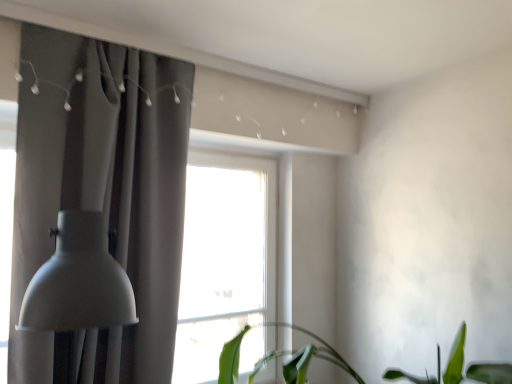
You are a GUI agent. You are given a task and a screenshot of the screen. Output one action in this format:
    pyautogui.click(x=<x>, y=<y>)
    Task: Click on the green leafy plant at lower center
    This screenshot has width=512, height=384.
    Given the screenshot: What is the action you would take?
    pyautogui.click(x=280, y=356)

At what (x,y) coordinates should I click in order to perform the action: click on matte gray curtain at left. Please return your answer as a coordinate pair (x, y). Looking at the image, I should click on (102, 187).

Measure the distance from matte gray curtain at left to green leafy plant at lower center.

The distance of matte gray curtain at left from green leafy plant at lower center is 92.61 centimeters.

From the image's perspective, relative to green leafy plant at lower center, is matte gray curtain at left above or below?

matte gray curtain at left is situated higher than green leafy plant at lower center in the image.

Considering the positions of point (166, 313) and point (275, 352), is point (166, 313) closer or farther from the camera than point (275, 352)?

Point (166, 313) is positioned closer to the camera compared to point (275, 352).

Does matte gray curtain at left have a greater width compared to green leafy plant at lower center?

No.

In the image, is green leafy plant at lower center on the left side or the right side of matte gray lampshade at left?

green leafy plant at lower center is to the right of matte gray lampshade at left.

This screenshot has width=512, height=384. Find the location of `houseplant to the right of matte gray lampshade at left`. houseplant to the right of matte gray lampshade at left is located at coordinates (280, 356).

Would you consider green leafy plant at lower center to be distant from matte gray lampshade at left?

green leafy plant at lower center is positioned a significant distance from matte gray lampshade at left.

Is green leafy plant at lower center situated inside matte gray lampshade at left or outside?

green leafy plant at lower center is not inside matte gray lampshade at left, it's outside.

Which object is further away from the camera, green leafy plant at lower center or matte gray curtain at left?

matte gray curtain at left is more distant.

You are a GUI agent. You are given a task and a screenshot of the screen. Output one action in this format:
    pyautogui.click(x=<x>, y=<y>)
    Task: Click on the houseplant to the right of matte gray curtain at left
    The height and width of the screenshot is (384, 512).
    Given the screenshot: What is the action you would take?
    pyautogui.click(x=280, y=356)

Are green leafy plant at lower center and matte gray curtain at left far apart?

green leafy plant at lower center is near matte gray curtain at left, not far away.

Between green leafy plant at lower center and matte gray curtain at left, which one has smaller width?

With smaller width is matte gray curtain at left.

From a real-world perspective, between matte gray curtain at left and matte gray lampshade at left, who is vertically lower?

matte gray lampshade at left is physically lower.

Is matte gray curtain at left to the right of matte gray lampshade at left from the viewer's perspective?

Yes.

What are the coordinates of `curtain that appears behind the matte gray lampshade at left` in the screenshot? It's located at pos(102,187).

Is matte gray curtain at left aimed at matte gray lampshade at left?

Yes, matte gray curtain at left is facing matte gray lampshade at left.

Considering the sizes of matte gray lampshade at left and green leafy plant at lower center in the image, is matte gray lampshade at left taller or shorter than green leafy plant at lower center?

Clearly, matte gray lampshade at left is taller compared to green leafy plant at lower center.

Can you tell me how much matte gray lampshade at left and green leafy plant at lower center differ in facing direction?

84.5 degrees.

From the image's perspective, which one is positioned higher, matte gray lampshade at left or green leafy plant at lower center?

matte gray lampshade at left appears higher in the image.

Is matte gray lampshade at left bigger than matte gray curtain at left?

No.

In order to click on table lamp to the left of matte gray curtain at left in this screenshot , I will do `click(81, 288)`.

From the image's perspective, is matte gray lampshade at left located above or below matte gray curtain at left?

From the image's perspective, matte gray lampshade at left appears below matte gray curtain at left.

From a real-world perspective, which object stands above the other?

From a 3D spatial view, matte gray curtain at left is above.

Locate an element on the screen. houseplant on the right of matte gray curtain at left is located at coordinates (280, 356).

At what (x,y) coordinates should I click in order to perform the action: click on table lamp behind the green leafy plant at lower center. Please return your answer as a coordinate pair (x, y). Image resolution: width=512 pixels, height=384 pixels. Looking at the image, I should click on (81, 288).

Based on their spatial positions, is matte gray lampshade at left or green leafy plant at lower center further from matte gray curtain at left?

green leafy plant at lower center.

Based on their spatial positions, is green leafy plant at lower center or matte gray curtain at left further from matte gray lampshade at left?

green leafy plant at lower center is positioned further to the anchor matte gray lampshade at left.

Based on their spatial positions, is matte gray lampshade at left or matte gray curtain at left closer to green leafy plant at lower center?

matte gray curtain at left.

When comparing their distances from matte gray curtain at left, does green leafy plant at lower center or matte gray lampshade at left seem further?

Among the two, green leafy plant at lower center is located further to matte gray curtain at left.

Based on their spatial positions, is matte gray curtain at left or matte gray lampshade at left further from green leafy plant at lower center?

matte gray lampshade at left.

Looking at the image, which one is located further to matte gray lampshade at left, matte gray curtain at left or green leafy plant at lower center?

Based on the image, green leafy plant at lower center appears to be further to matte gray lampshade at left.

The height and width of the screenshot is (384, 512). Find the location of `curtain between matte gray lampshade at left and green leafy plant at lower center in the horizontal direction`. curtain between matte gray lampshade at left and green leafy plant at lower center in the horizontal direction is located at coordinates (102, 187).